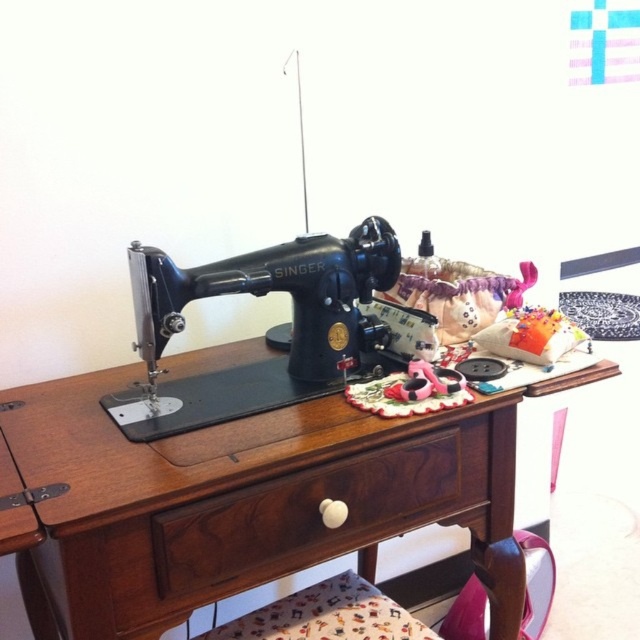
Is the position of wooden sewing machine at center less distant than that of brown wood drawer at center?

Yes.

Find the location of a particular element. The height and width of the screenshot is (640, 640). wooden sewing machine at center is located at coordinates (241, 500).

Is point (58, 525) positioned behind point (440, 502)?

No, (58, 525) is in front of (440, 502).

Locate an element on the screen. The image size is (640, 640). wooden sewing machine at center is located at coordinates (241, 500).

Which is more to the right, wooden sewing machine at center or black metal sewing machine at center?

Positioned to the right is wooden sewing machine at center.

Between point (90, 490) and point (317, 381), which one is positioned behind?

Positioned behind is point (317, 381).

Which is in front, point (232, 556) or point (208, 284)?

Point (232, 556) is in front.

Locate an element on the screen. Image resolution: width=640 pixels, height=640 pixels. wooden sewing machine at center is located at coordinates (241, 500).

Is black metal sewing machine at center further to the viewer compared to brown wood drawer at center?

Yes, black metal sewing machine at center is behind brown wood drawer at center.

Which is more to the left, black metal sewing machine at center or brown wood drawer at center?

black metal sewing machine at center

Between point (276, 280) and point (282, 572), which one is positioned behind?

The point (276, 280) is more distant.

Locate an element on the screen. black metal sewing machine at center is located at coordinates (259, 296).